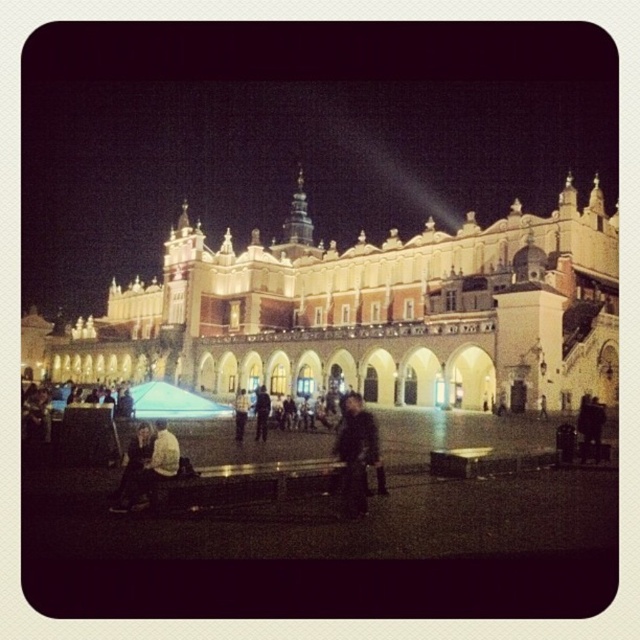
Question: Is the position of light brown stone building at center less distant than that of light brown leather jacket at lower left?

Choices:
 (A) no
 (B) yes

Answer: (A)

Question: Is dark blue jacket at center closer to the viewer compared to light brown leather jacket at center?

Choices:
 (A) yes
 (B) no

Answer: (B)

Question: Which of these objects is positioned farthest from the light brown leather jacket at center?

Choices:
 (A) light brown stone building at center
 (B) dark brown leather jacket at lower left
 (C) light brown leather jacket at lower left

Answer: (A)

Question: Is light brown stone building at center in front of dark blue jacket at center?

Choices:
 (A) no
 (B) yes

Answer: (A)

Question: Which of these objects is positioned closest to the dark brown leather jacket at center?

Choices:
 (A) dark brown leather jacket at lower left
 (B) dark blue jacket at center
 (C) light brown stone building at center

Answer: (B)

Question: Considering the real-world distances, which object is farthest from the light brown leather jacket at center?

Choices:
 (A) light brown leather jacket at lower left
 (B) dark brown leather jacket at lower left
 (C) light brown stone building at center

Answer: (C)